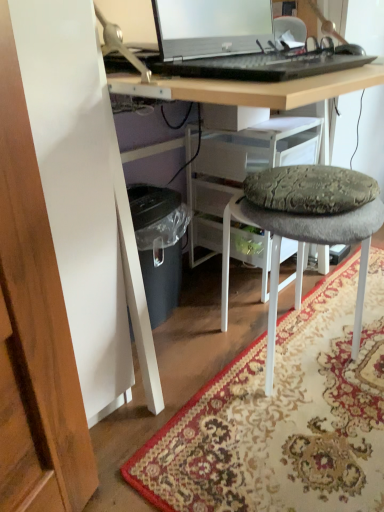
What are the coordinates of `sleek silver laptop at upper center` in the screenshot? It's located at coord(235,45).

Measure the distance between sleek silver laptop at upper center and camera.

They are 28.03 inches apart.

Where is `textured gray cushioned stool at center`? Image resolution: width=384 pixels, height=512 pixels. textured gray cushioned stool at center is located at coordinates (305, 226).

Considering the positions of objects textured gray cushioned stool at center and patterned carpet at lower center in the image provided, who is behind, textured gray cushioned stool at center or patterned carpet at lower center?

textured gray cushioned stool at center is further away from the camera.

The height and width of the screenshot is (512, 384). In the image, there is a patterned carpet at lower center. In order to click on stool above it (from the image's perspective) in this screenshot , I will do `click(305, 226)`.

Considering the relative sizes of textured gray cushioned stool at center and patterned carpet at lower center in the image provided, is textured gray cushioned stool at center thinner than patterned carpet at lower center?

Indeed, textured gray cushioned stool at center has a lesser width compared to patterned carpet at lower center.

Considering the positions of objects sleek silver laptop at upper center and textured gray cushioned stool at center in the image provided, who is in front, sleek silver laptop at upper center or textured gray cushioned stool at center?

sleek silver laptop at upper center is closer to the camera.

Considering the relative sizes of sleek silver laptop at upper center and textured gray cushioned stool at center in the image provided, is sleek silver laptop at upper center thinner than textured gray cushioned stool at center?

Yes, sleek silver laptop at upper center is thinner than textured gray cushioned stool at center.

From the picture: Is sleek silver laptop at upper center aimed at textured gray cushioned stool at center?

No, sleek silver laptop at upper center is not turned towards textured gray cushioned stool at center.

From a real-world perspective, is textured gray cushioned stool at center located beneath sleek silver laptop at upper center?

Indeed, from a real-world perspective, textured gray cushioned stool at center is positioned beneath sleek silver laptop at upper center.

Looking at this image, is textured gray cushioned stool at center directly adjacent to sleek silver laptop at upper center?

No, textured gray cushioned stool at center is not next to sleek silver laptop at upper center.

Which of these two, textured gray cushioned stool at center or sleek silver laptop at upper center, is wider?

textured gray cushioned stool at center is wider.

Could you tell me if textured gray cushioned stool at center is turned towards sleek silver laptop at upper center?

No.

Who is shorter, sleek silver laptop at upper center or patterned carpet at lower center?

patterned carpet at lower center.

Can you confirm if sleek silver laptop at upper center is thinner than patterned carpet at lower center?

Indeed, sleek silver laptop at upper center has a lesser width compared to patterned carpet at lower center.

Between sleek silver laptop at upper center and patterned carpet at lower center, which one has larger size?

With larger size is patterned carpet at lower center.

From the image's perspective, between sleek silver laptop at upper center and patterned carpet at lower center, which one is located above?

sleek silver laptop at upper center, from the image's perspective.

Consider the image. From the image's perspective, between patterned carpet at lower center and sleek silver laptop at upper center, who is located below?

patterned carpet at lower center is shown below in the image.

In the scene shown: What's the angular difference between patterned carpet at lower center and sleek silver laptop at upper center's facing directions?

The facing directions of patterned carpet at lower center and sleek silver laptop at upper center are 0.7 degrees apart.

Who is shorter, patterned carpet at lower center or sleek silver laptop at upper center?

patterned carpet at lower center is shorter.

Consider the image. Is the surface of patterned carpet at lower center in direct contact with sleek silver laptop at upper center?

No, patterned carpet at lower center is not in contact with sleek silver laptop at upper center.

Which of these two, patterned carpet at lower center or textured gray cushioned stool at center, is smaller?

Smaller between the two is patterned carpet at lower center.

Does patterned carpet at lower center turn towards textured gray cushioned stool at center?

No, patterned carpet at lower center is not oriented towards textured gray cushioned stool at center.

From a real-world perspective, is patterned carpet at lower center under textured gray cushioned stool at center?

Yes, from a real-world perspective, patterned carpet at lower center is under textured gray cushioned stool at center.

Would you say patterned carpet at lower center is inside or outside textured gray cushioned stool at center?

The correct answer is: outside.

Locate an element on the screen. mat below the textured gray cushioned stool at center (from the image's perspective) is located at coordinates (283, 417).

At what (x,y) coordinates should I click in order to perform the action: click on computer above the textured gray cushioned stool at center (from the image's perspective). Please return your answer as a coordinate pair (x, y). Image resolution: width=384 pixels, height=512 pixels. Looking at the image, I should click on (235, 45).

Estimate the real-world distances between objects in this image. Which object is further from sleek silver laptop at upper center, patterned carpet at lower center or textured gray cushioned stool at center?

patterned carpet at lower center.

When comparing their distances from textured gray cushioned stool at center, does sleek silver laptop at upper center or patterned carpet at lower center seem closer?

patterned carpet at lower center is positioned closer to the anchor textured gray cushioned stool at center.

Based on their spatial positions, is patterned carpet at lower center or sleek silver laptop at upper center further from textured gray cushioned stool at center?

sleek silver laptop at upper center.

Which object lies nearer to the anchor point patterned carpet at lower center, textured gray cushioned stool at center or sleek silver laptop at upper center?

textured gray cushioned stool at center is closer to patterned carpet at lower center.

From the image, which object appears to be nearer to patterned carpet at lower center, sleek silver laptop at upper center or textured gray cushioned stool at center?

textured gray cushioned stool at center is closer to patterned carpet at lower center.

Considering their positions, is textured gray cushioned stool at center positioned further to sleek silver laptop at upper center than patterned carpet at lower center?

patterned carpet at lower center.

I want to click on stool between sleek silver laptop at upper center and patterned carpet at lower center in the vertical direction, so click(305, 226).